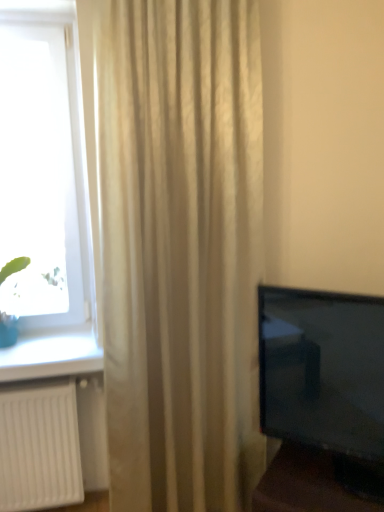
Question: Choose the correct answer: Is green leafy plant at left inside beige textured curtain at center or outside it?

Choices:
 (A) outside
 (B) inside

Answer: (A)

Question: From their relative heights in the image, would you say green leafy plant at left is taller or shorter than beige textured curtain at center?

Choices:
 (A) short
 (B) tall

Answer: (A)

Question: Which object is positioned closest to the transparent glass window at left?

Choices:
 (A) green leafy plant at left
 (B) beige textured curtain at center

Answer: (B)

Question: Estimate the real-world distances between objects in this image. Which object is closer to the transparent glass window at left?

Choices:
 (A) beige textured curtain at center
 (B) green leafy plant at left

Answer: (A)